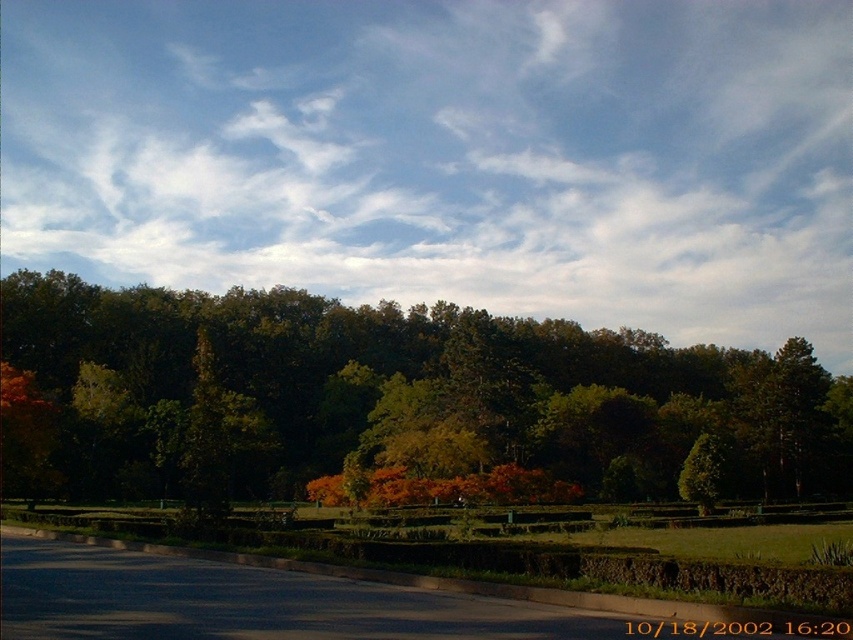
Question: Which of the following is the closest to the observer?

Choices:
 (A) (280, 372)
 (B) (113, 99)

Answer: (A)

Question: Does white fluffy cloud at upper center come in front of green leafy tree at center?

Choices:
 (A) yes
 (B) no

Answer: (B)

Question: Which object is farther from the camera taking this photo?

Choices:
 (A) white fluffy cloud at upper center
 (B) green leafy tree at center

Answer: (A)

Question: Does white fluffy cloud at upper center come behind green leafy tree at center?

Choices:
 (A) no
 (B) yes

Answer: (B)

Question: Does white fluffy cloud at upper center appear over green leafy tree at center?

Choices:
 (A) no
 (B) yes

Answer: (B)